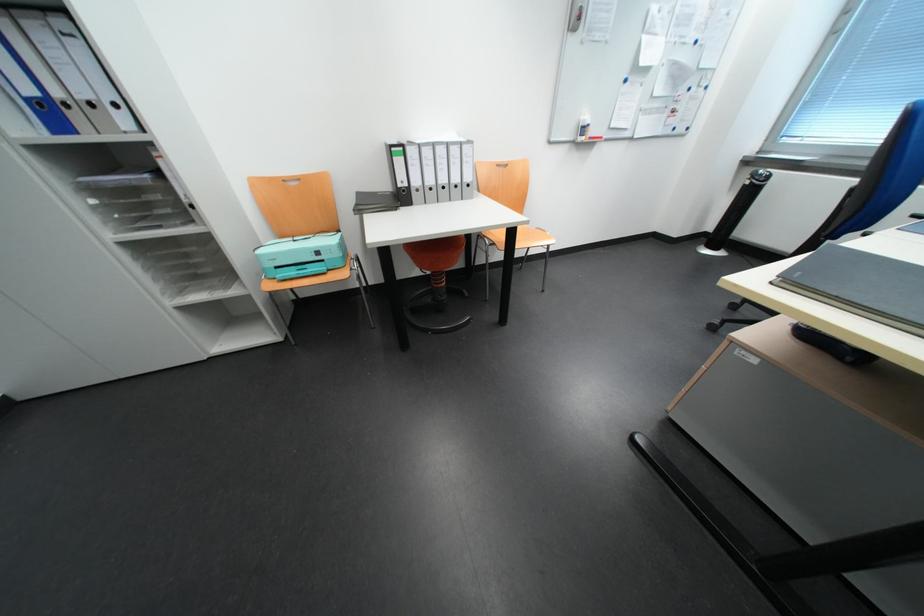
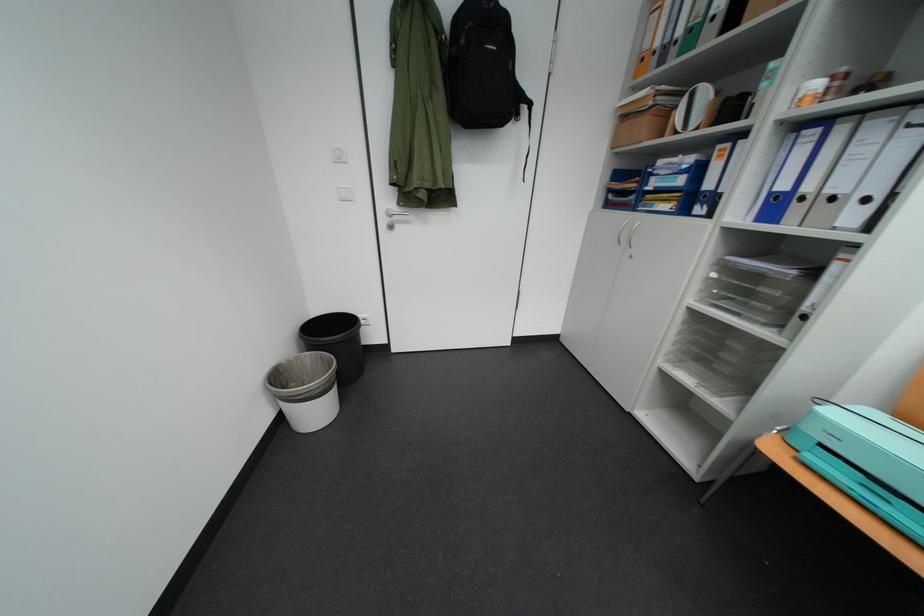
The point at [91,99] is marked in the first image. Where is the corresponding point in the second image?

(841, 193)